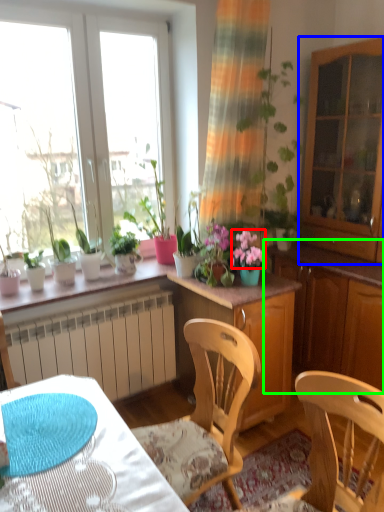
Question: Which object is the closest to the flower (highlighted by a red box)? Choose among these: cabinetry (highlighted by a blue box) or dresser (highlighted by a green box).

Choices:
 (A) cabinetry
 (B) dresser

Answer: (B)